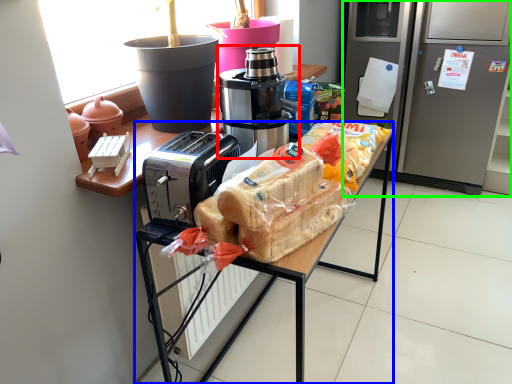
Question: Considering the real-world distances, which object is closest to coffee maker (highlighted by a red box)? desk (highlighted by a blue box) or home appliance (highlighted by a green box).

Choices:
 (A) desk
 (B) home appliance

Answer: (A)